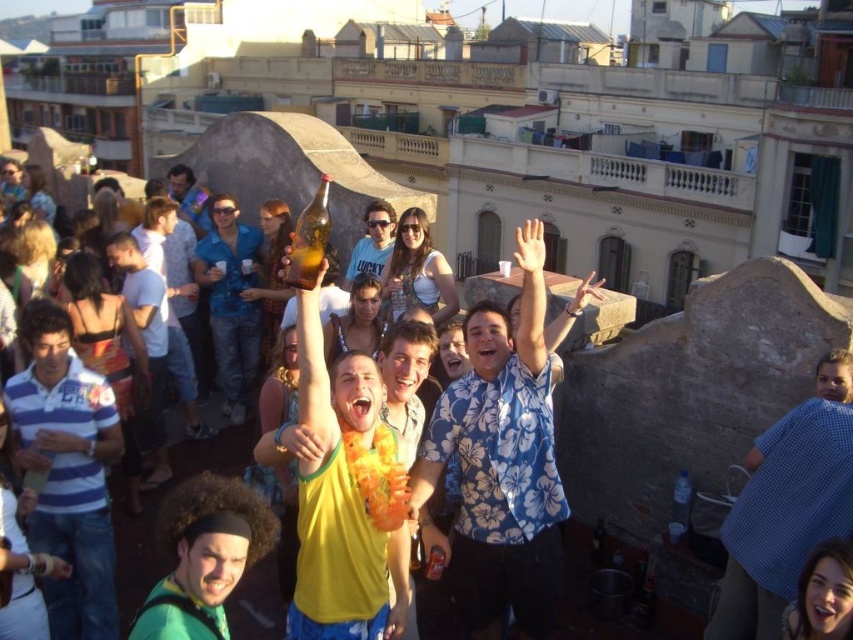
Question: Is blue checkered shirt at lower right above smooth skin face at center?

Choices:
 (A) yes
 (B) no

Answer: (A)

Question: From the image, what is the correct spatial relationship of blue checkered shirt at lower right in relation to smooth skin face at center?

Choices:
 (A) left
 (B) right

Answer: (B)

Question: Among these points, which one is nearest to the camera?

Choices:
 (A) (846, 493)
 (B) (843, 612)

Answer: (B)

Question: Among these points, which one is farthest from the camera?

Choices:
 (A) (820, 385)
 (B) (850, 561)

Answer: (A)

Question: Is blue checkered shirt at lower right to the left of smooth skin face at center from the viewer's perspective?

Choices:
 (A) no
 (B) yes

Answer: (A)

Question: Which point is farther to the camera?

Choices:
 (A) smooth skin face at center
 (B) blue checkered shirt at lower right

Answer: (B)